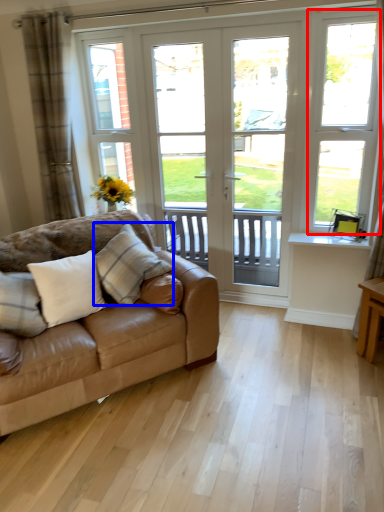
Question: Which object is closer to the camera taking this photo, window frame (highlighted by a red box) or pillow (highlighted by a blue box)?

Choices:
 (A) window frame
 (B) pillow

Answer: (B)